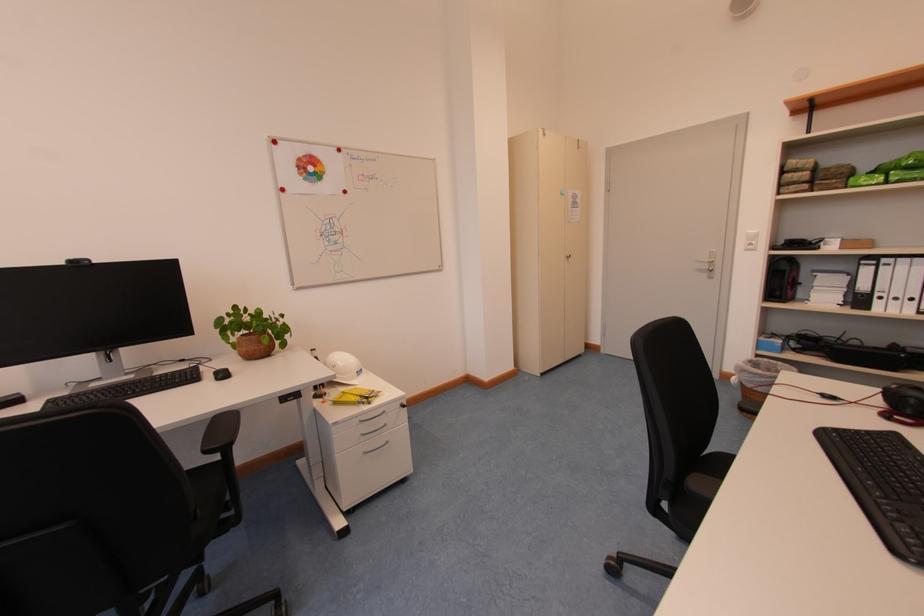
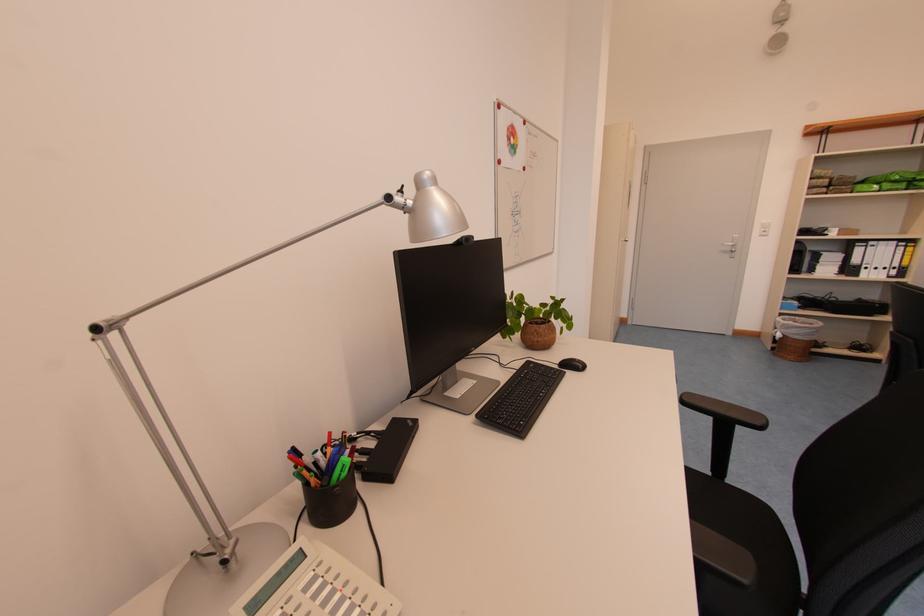
Locate, in the second image, the point that corresponds to point 712,270 in the first image.

(736, 252)